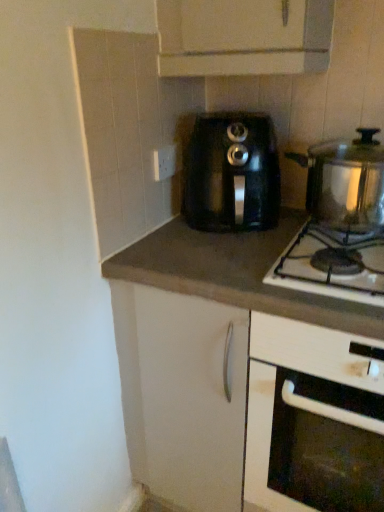
The width and height of the screenshot is (384, 512). In order to click on vacant region above matte gray countertop at center (from a real-world perspective) in this screenshot , I will do `click(204, 246)`.